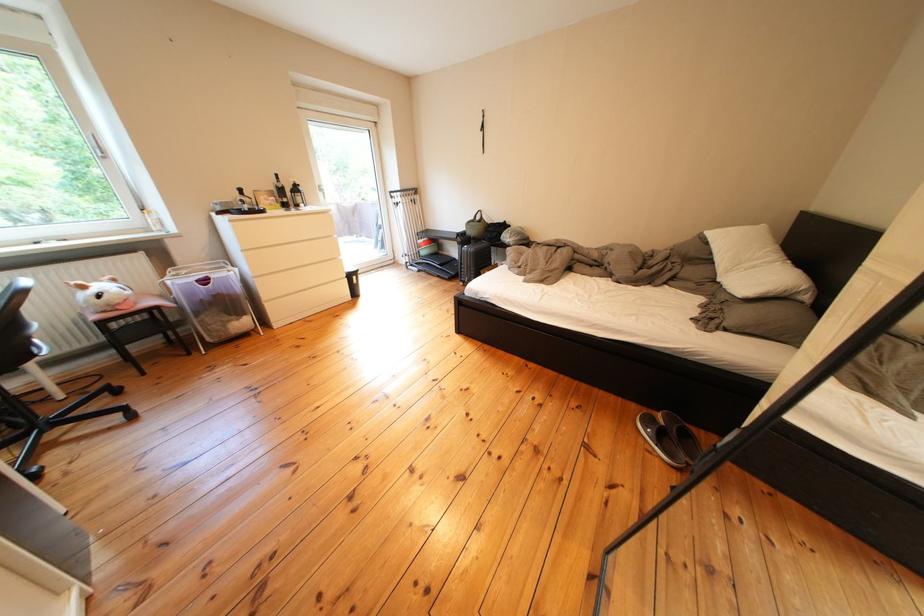
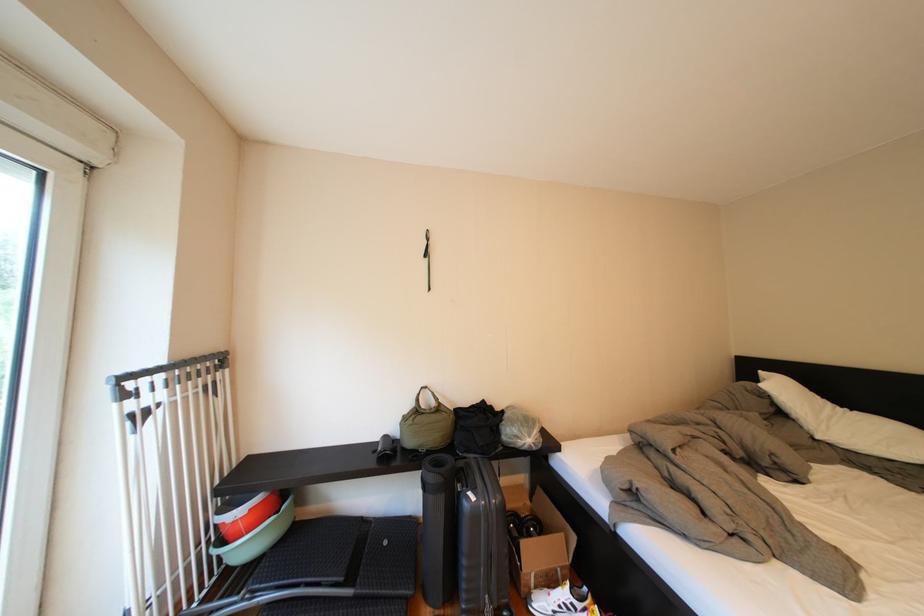
Find the pixel in the second image that matches pixel 438 256 in the first image.

(261, 551)